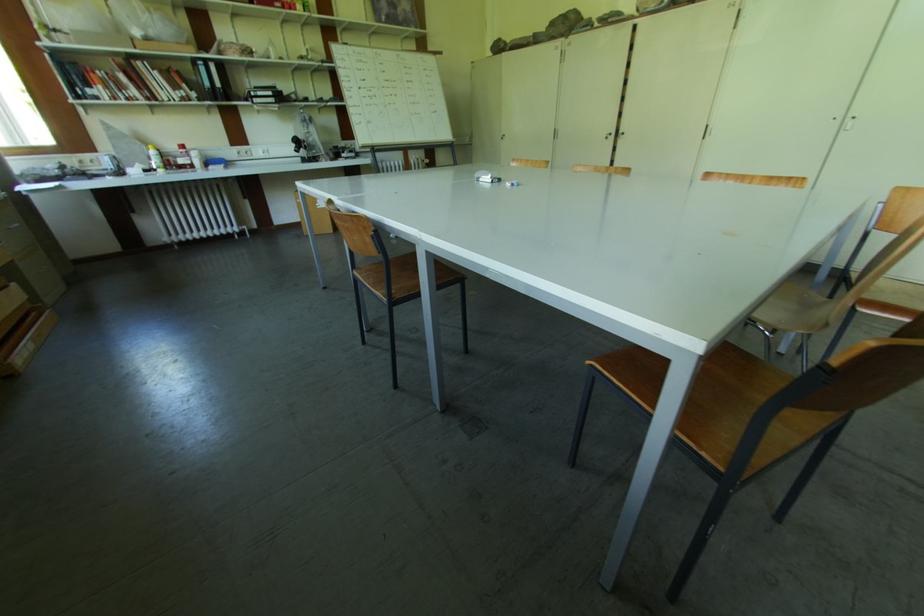
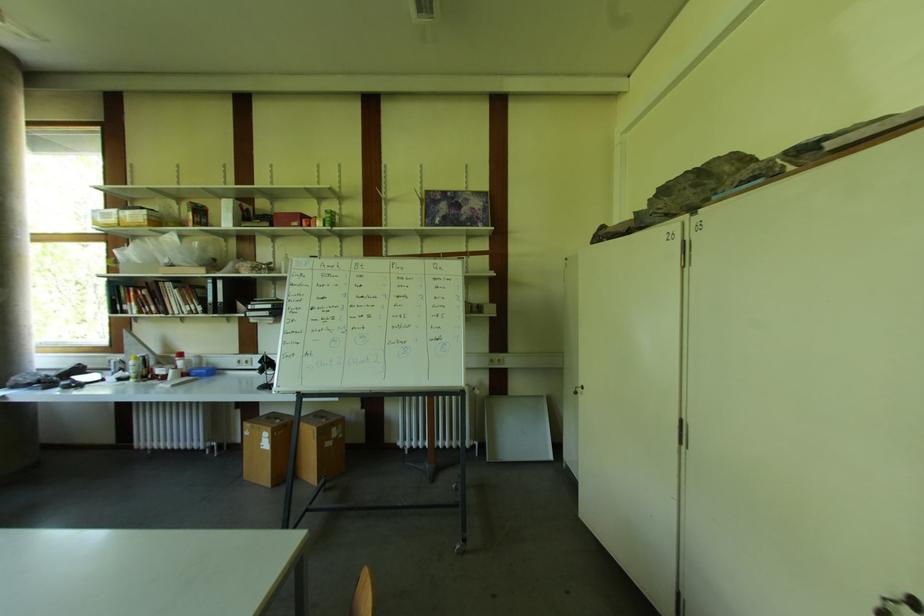
The point at (186, 148) is marked in the first image. Where is the corresponding point in the second image?

(184, 357)